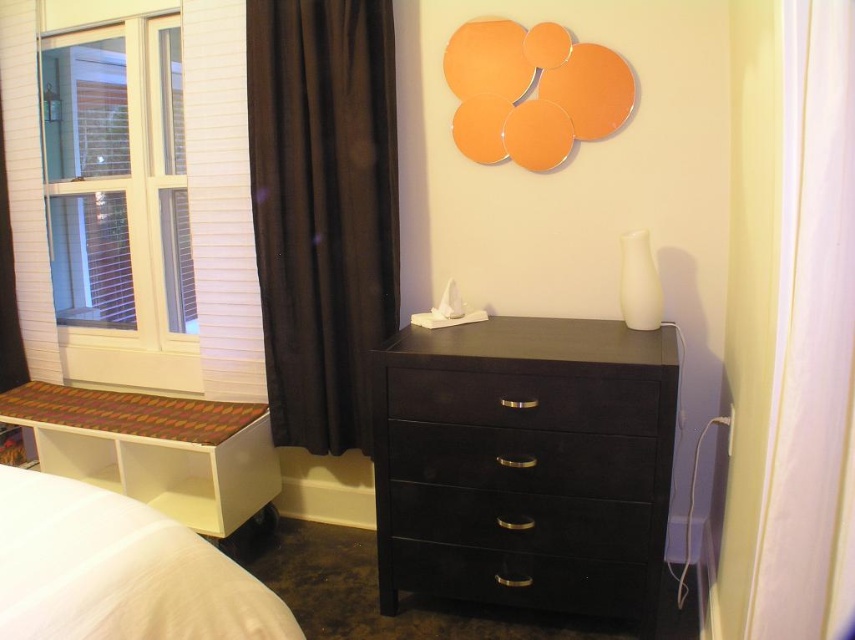
How much distance is there between white soft bed at lower left and black glossy drawer at lower center?

white soft bed at lower left is 28.93 inches from black glossy drawer at lower center.

Can you confirm if white soft bed at lower left is thinner than black glossy drawer at lower center?

Indeed, white soft bed at lower left has a lesser width compared to black glossy drawer at lower center.

The image size is (855, 640). I want to click on white soft bed at lower left, so click(118, 570).

This screenshot has width=855, height=640. Find the location of `white soft bed at lower left`. white soft bed at lower left is located at coordinates (118, 570).

Is point (386, 83) positioned before point (146, 620)?

No, it is behind (146, 620).

Does brown velvet curtain at left appear under white soft bed at lower left?

Incorrect, brown velvet curtain at left is not positioned below white soft bed at lower left.

This screenshot has height=640, width=855. Describe the element at coordinates (322, 209) in the screenshot. I see `brown velvet curtain at left` at that location.

Where is `brown velvet curtain at left`? Image resolution: width=855 pixels, height=640 pixels. brown velvet curtain at left is located at coordinates (322, 209).

Can you confirm if matte black dresser at center is thinner than black matte drawer at center?

In fact, matte black dresser at center might be wider than black matte drawer at center.

Who is more forward, (593,481) or (544,376)?

Point (544,376) is in front.

At what (x,y) coordinates should I click in order to perform the action: click on matte black dresser at center. Please return your answer as a coordinate pair (x, y). The width and height of the screenshot is (855, 640). Looking at the image, I should click on (525, 465).